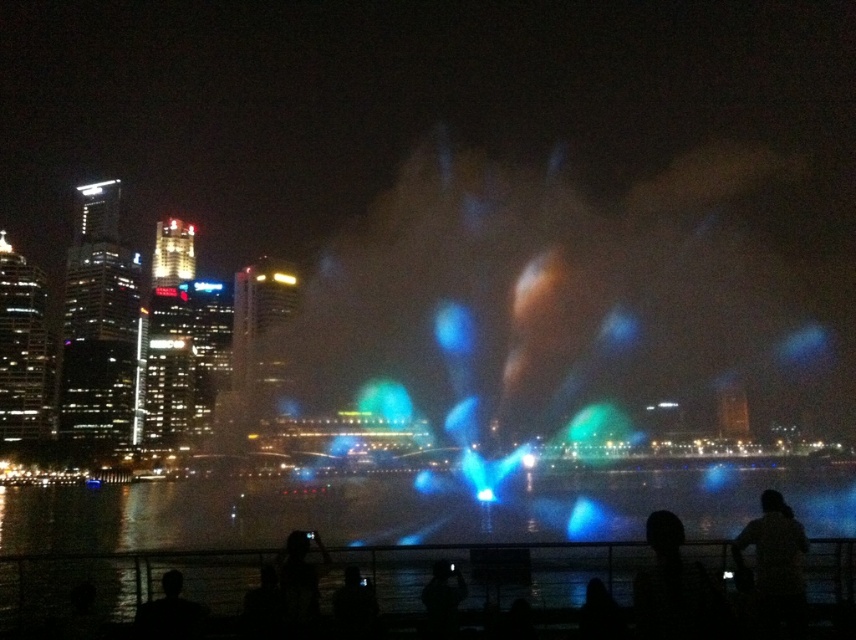
Between point (198, 515) and point (789, 602), which one is positioned behind?

Point (198, 515)

Is transparent liquid water at center smaller than dark fabric shirt at lower right?

Actually, transparent liquid water at center might be larger than dark fabric shirt at lower right.

Measure the distance between point [266,509] and camera.

Point [266,509] and camera are 143.64 meters apart from each other.

Identify the location of transparent liquid water at center. The image size is (856, 640). (438, 516).

How much distance is there between dark fabric shirt at lower right and silhouette skin at lower left?

dark fabric shirt at lower right is 163.20 feet from silhouette skin at lower left.

Between dark fabric shirt at lower right and silhouette skin at lower left, which one appears on the left side from the viewer's perspective?

silhouette skin at lower left

Locate an element on the screen. The image size is (856, 640). dark fabric shirt at lower right is located at coordinates (776, 566).

Who is more distant from viewer, (675, 525) or (146, 628)?

The point (675, 525) is more distant.

Between point (645, 627) and point (143, 625), which one is positioned behind?

Point (143, 625)

Identify the location of silhouette hair at center. (670, 586).